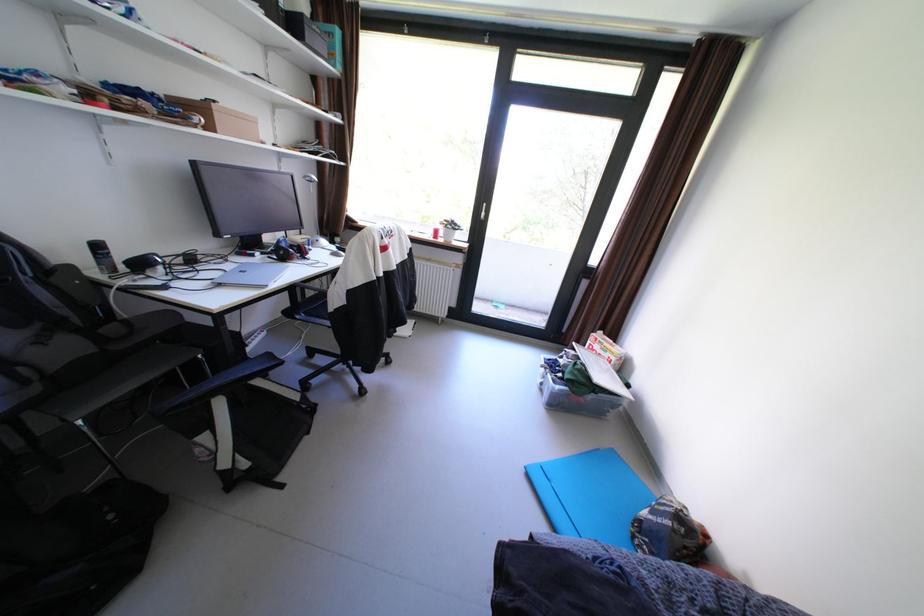
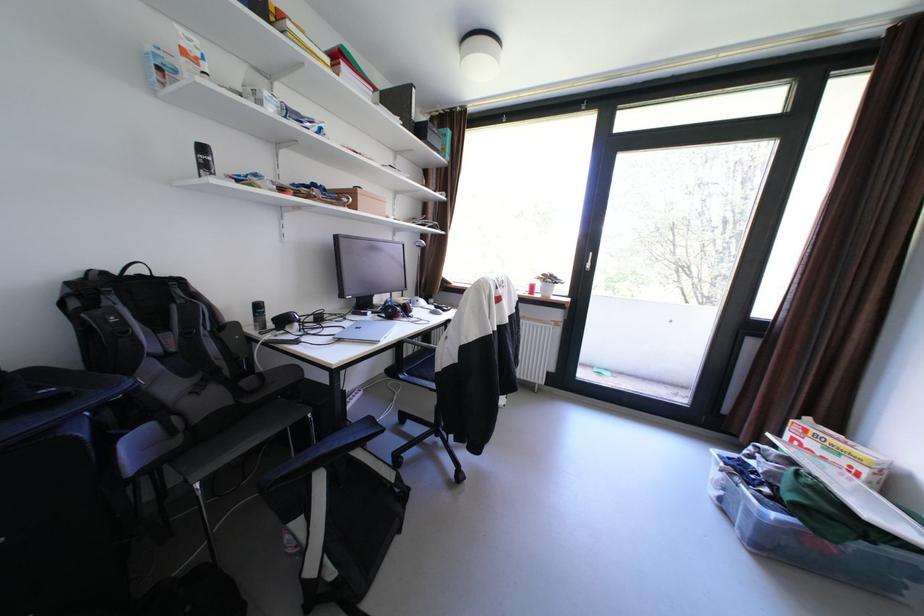
In the second image, find the point that corresponds to [568,387] in the first image.

(784, 516)